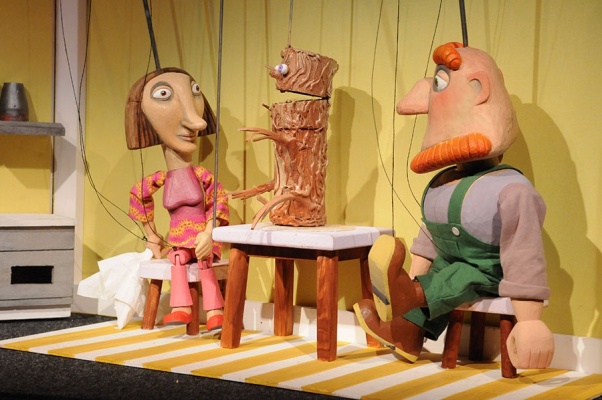
At what (x,y) coordinates should I click in order to perform the action: click on white table top. Please return your answer as a coordinate pair (x, y). This screenshot has height=400, width=602. Looking at the image, I should click on (293, 237).